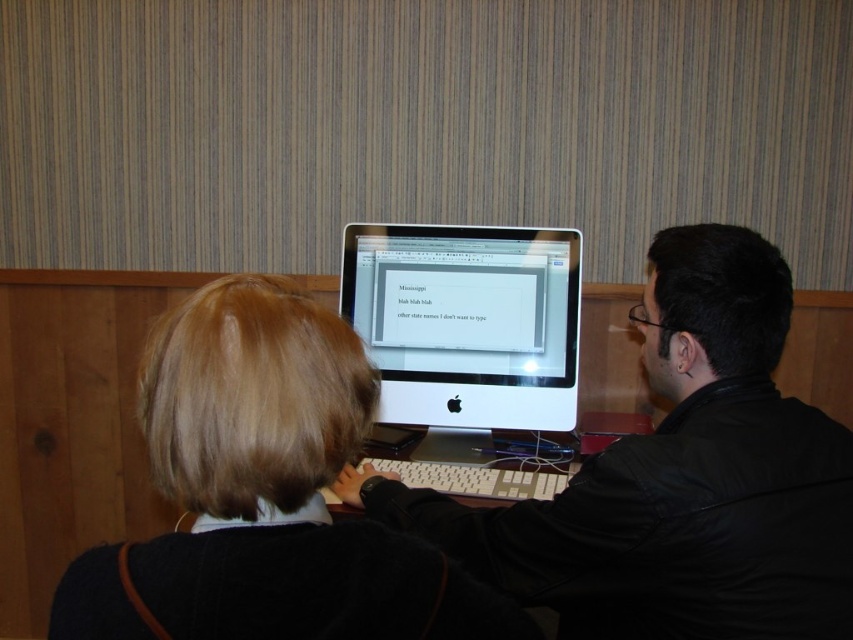
Question: Is matte black computer at center bigger than matte black sweater at center?

Choices:
 (A) yes
 (B) no

Answer: (A)

Question: Which object appears farthest from the camera in this image?

Choices:
 (A) white glossy computer monitor at center
 (B) matte black sweater at center

Answer: (A)

Question: Based on their relative distances, which object is nearer to the matte black computer at center?

Choices:
 (A) matte black sweater at center
 (B) white glossy computer monitor at center

Answer: (A)

Question: From the image, what is the correct spatial relationship of matte black computer at center in relation to matte black sweater at center?

Choices:
 (A) left
 (B) right

Answer: (B)

Question: Does matte black computer at center appear on the left side of matte black sweater at center?

Choices:
 (A) yes
 (B) no

Answer: (B)

Question: Which point is closer to the camera?

Choices:
 (A) (234, 403)
 (B) (560, 564)
 (C) (469, 339)

Answer: (A)